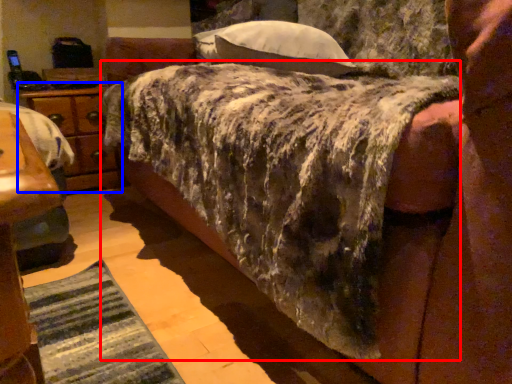
Question: Which object is closer to the camera taking this photo, mattress (highlighted by a red box) or nightstand (highlighted by a blue box)?

Choices:
 (A) mattress
 (B) nightstand

Answer: (A)